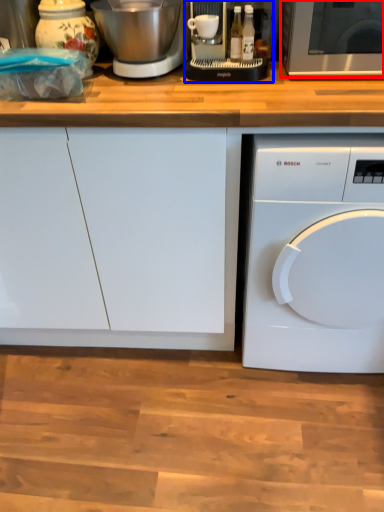
Question: Which object appears closest to the camera in this image, microwave oven (highlighted by a red box) or food processor (highlighted by a blue box)?

Choices:
 (A) microwave oven
 (B) food processor

Answer: (A)